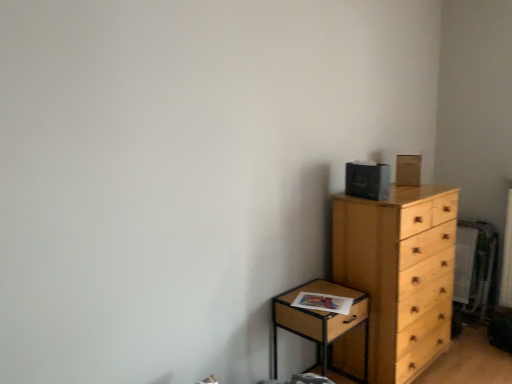
Question: Is light wood chest of drawers at right bigger or smaller than wooden nightstand at lower right?

Choices:
 (A) small
 (B) big

Answer: (B)

Question: Considering the positions of light wood chest of drawers at right and wooden nightstand at lower right in the image, is light wood chest of drawers at right wider or thinner than wooden nightstand at lower right?

Choices:
 (A) wide
 (B) thin

Answer: (A)

Question: In the image, is light wood chest of drawers at right on the left side or the right side of wooden nightstand at lower right?

Choices:
 (A) left
 (B) right

Answer: (B)

Question: Is wooden nightstand at lower right to the left or to the right of light wood chest of drawers at right in the image?

Choices:
 (A) left
 (B) right

Answer: (A)

Question: Do you think wooden nightstand at lower right is within light wood chest of drawers at right, or outside of it?

Choices:
 (A) outside
 (B) inside

Answer: (A)

Question: Based on their sizes in the image, would you say wooden nightstand at lower right is bigger or smaller than light wood chest of drawers at right?

Choices:
 (A) big
 (B) small

Answer: (B)

Question: Considering the positions of point (364, 329) and point (346, 360), is point (364, 329) closer or farther from the camera than point (346, 360)?

Choices:
 (A) farther
 (B) closer

Answer: (B)